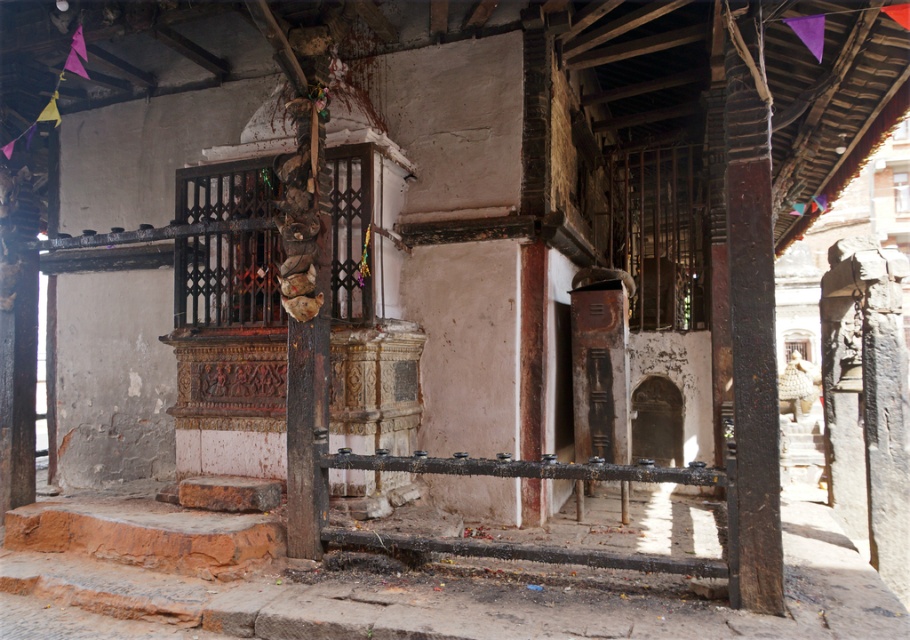
You are an architect assessing the structural integrity of the temple. You notice the brown rough wood pillar at right and the rusty metal rail at center. Which of these two objects is narrower in width?

The brown rough wood pillar at right has a lesser width compared to the rusty metal rail at center, so it is narrower.

You are an architect inspecting the temple. You notice the brown rough wood pillar at right and the rusty metal rail at center. Which of these two objects is narrower in width?

The brown rough wood pillar at right is smaller than the rusty metal rail at center, so the brown rough wood pillar at right is narrower in width.

You are a visitor standing at the entrance of the temple and want to touch both the brown rough wood pillar at right and the rusty metal rail at center. Which object would you need to reach higher to touch?

The brown rough wood pillar at right is positioned over the rusty metal rail at center, so you would need to reach higher to touch the brown rough wood pillar at right.